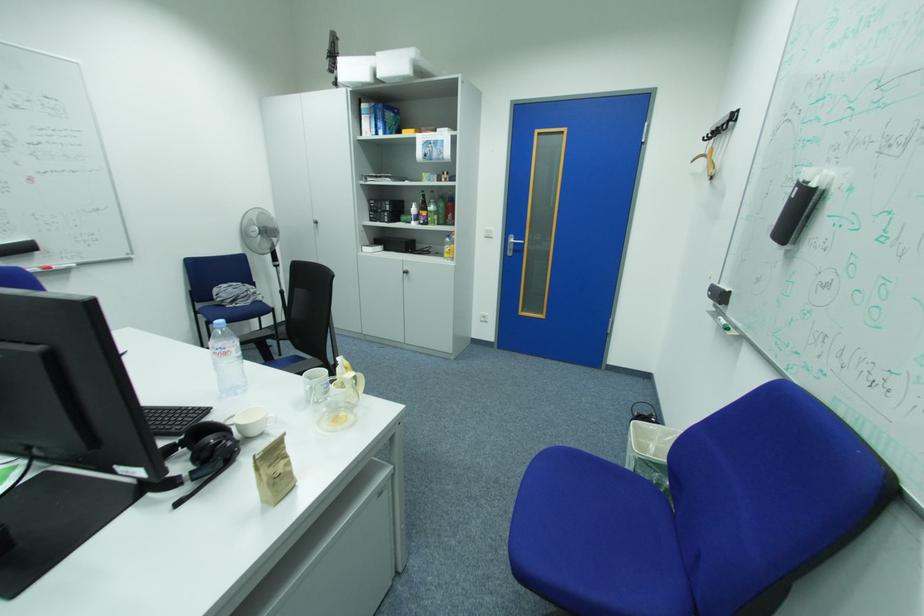
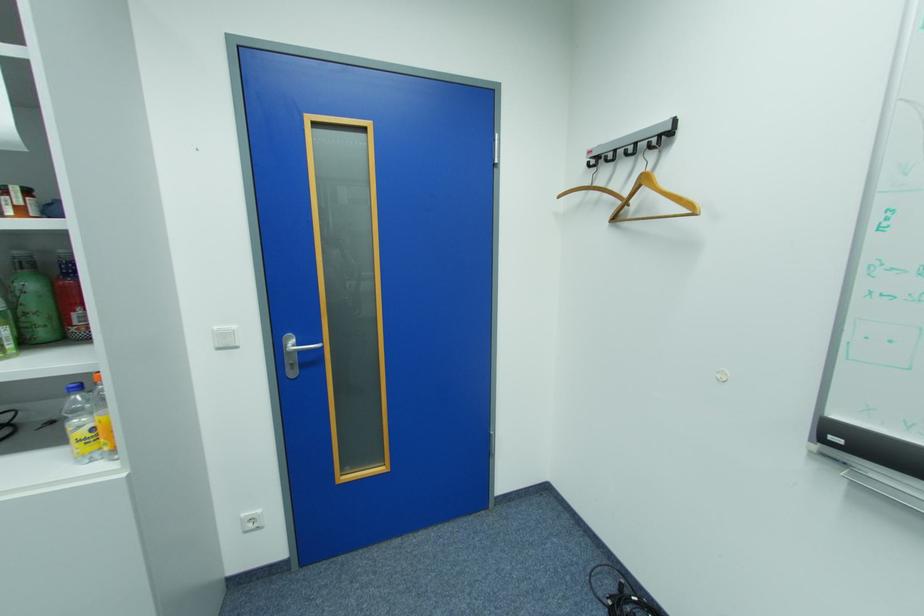
Find the pixel in the second image that matches point 491,314 in the first image.

(252, 516)